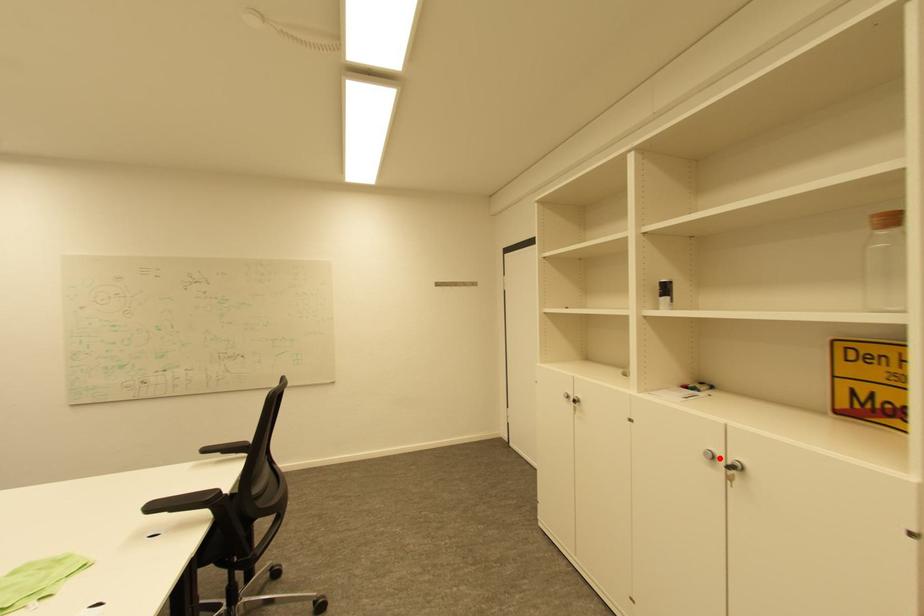
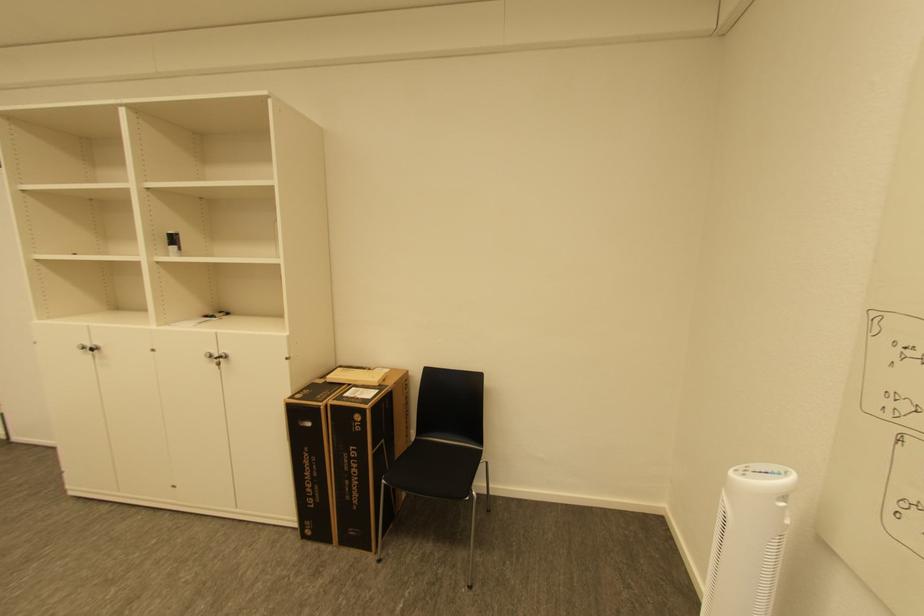
Where in the second image is the point corresponding to the highlighted location from the first image?

(217, 357)